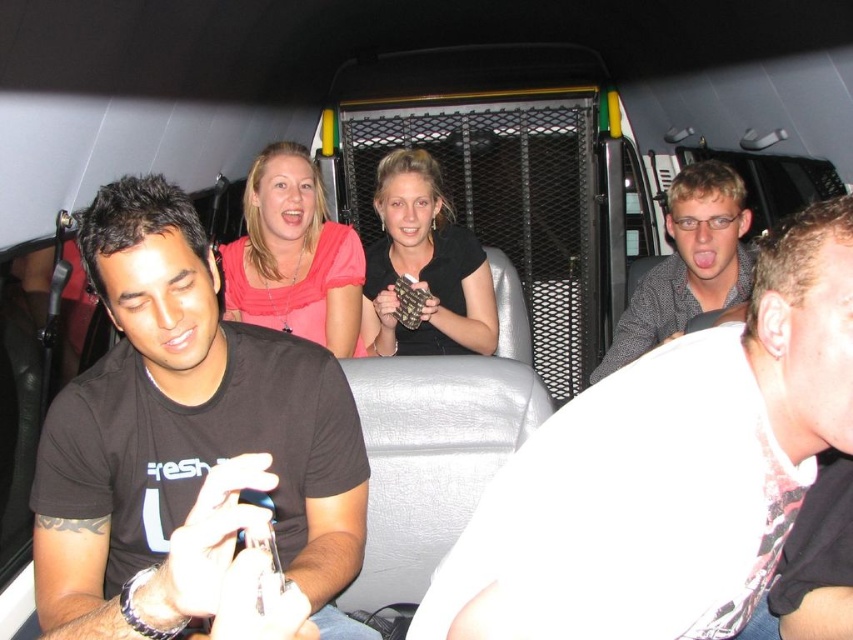
Consider the image. You are a photographer trying to capture a clear shot of both the black matte necklace at center and the checkered fabric shirt at right. Since you can only focus on one subject at a time, which one should you choose to ensure the other is still somewhat visible in the background?

You should focus on the black matte necklace at center because the checkered fabric shirt at right is behind it, making the shirt visible in the background when the necklace is in focus.

You are sitting in a vehicle with four friends. You want to take a photo of the matte black shirt at center without moving your head. Can you do this while keeping your current posture?

The matte black shirt at center and viewer are 27.74 inches apart from each other, so yes, you can take a photo of the matte black shirt at center without moving your head while maintaining your current posture since the distance allows for a clear capture.

You are standing in front of a vehicle with a group of people inside. There is a point located at coordinates point (730, 634). If you want to reach that point with your hand, will you be able to do so without moving closer to the vehicle?

The point (730, 634) is 37.63 inches away from the camera. Since the average human arm length is about 25 inches, you would need to move closer to the vehicle to reach it with your hand.